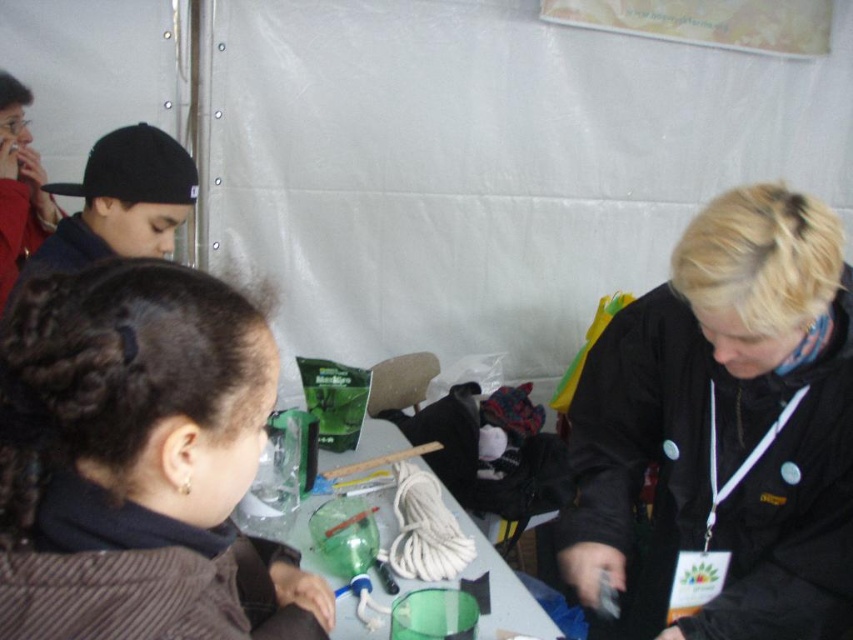
What do you see at coordinates (724, 429) in the screenshot? I see `black matte jacket at upper right` at bounding box center [724, 429].

Does point (581, 536) come closer to viewer compared to point (171, 144)?

Yes, it is in front of point (171, 144).

Identify the location of black matte jacket at upper right. (724, 429).

Between dark brown hair at upper left and translucent plastic table at center, which one has more height?

dark brown hair at upper left

The height and width of the screenshot is (640, 853). Describe the element at coordinates (129, 452) in the screenshot. I see `dark brown hair at upper left` at that location.

Find the location of a particular element. This screenshot has height=640, width=853. dark brown hair at upper left is located at coordinates 129,452.

Does dark brown hair at upper left appear under black matte cap at upper left?

Indeed, dark brown hair at upper left is positioned under black matte cap at upper left.

Between dark brown hair at upper left and black matte cap at upper left, which one is positioned higher?

black matte cap at upper left is above.

Who is more forward, (3,436) or (61,260)?

Point (3,436)

Identify the location of dark brown hair at upper left. (129, 452).